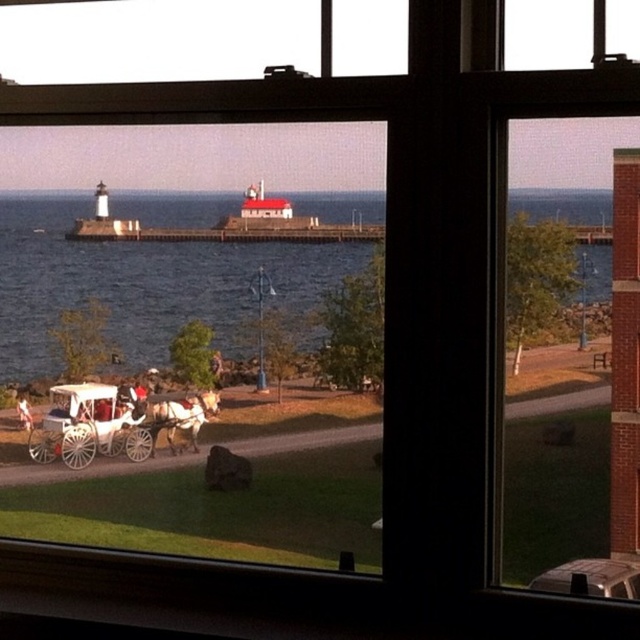
Who is more distant from viewer, (170, 435) or (20, 394)?

Positioned behind is point (170, 435).

The height and width of the screenshot is (640, 640). What do you see at coordinates (180, 417) in the screenshot?
I see `shiny brown horse at center` at bounding box center [180, 417].

Where is `shiny brown horse at center`? This screenshot has width=640, height=640. shiny brown horse at center is located at coordinates (180, 417).

Is point (26, 248) positioned behind point (205, 419)?

That is False.

Is blue water at center thinner than shiny brown horse at center?

Incorrect, blue water at center's width is not less than shiny brown horse at center's.

Who is more forward, (24, 224) or (168, 413)?

Point (24, 224)

At what (x,y) coordinates should I click in order to perform the action: click on blue water at center. Please return your answer as a coordinate pair (x, y). This screenshot has width=640, height=640. Looking at the image, I should click on [x=140, y=282].

Can you confirm if blue water at center is smaller than white fabric horse at lower left?

No.

Does blue water at center appear under white fabric horse at lower left?

No.

Does point (330, 256) lie behind point (28, 408)?

That is False.

This screenshot has width=640, height=640. I want to click on blue water at center, so click(x=140, y=282).